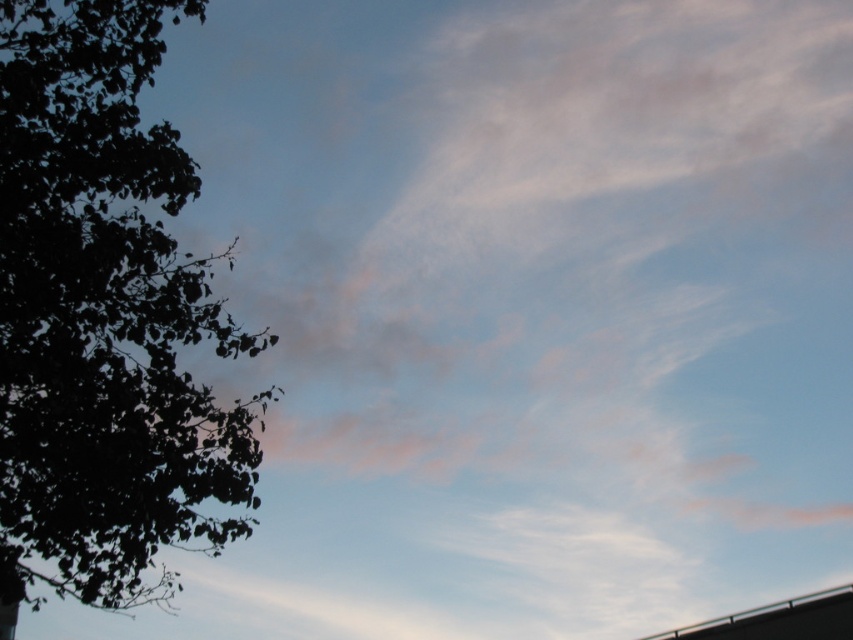
You are standing in the scene and want to move from the point at coordinates point (146, 291) to the point at coordinates point (844, 637). Which direction should you face to move towards the second point?

Since point (146, 291) is closer to the viewer than point (844, 637), you should face away from the viewer to move towards the second point.

You are a drone operator planning to fly a drone between the dark green leafy tree at left and the metallic gray overpass at bottom right. The drone has a maximum flight range of 25 meters. Can the drone safely make the trip without needing to recharge?

The dark green leafy tree at left and metallic gray overpass at bottom right are 26.54 meters apart. Since the drone can only fly 25 meters before needing to recharge, it cannot safely make the trip without recharging.

You are a bird soaring in the sky scene. You want to land on the nearest object to rest. Which object should you choose between the dark green leafy tree at left and the metallic gray overpass at bottom right?

The dark green leafy tree at left is closer to the viewer than the metallic gray overpass at bottom right, so you should choose the dark green leafy tree at left to land on.